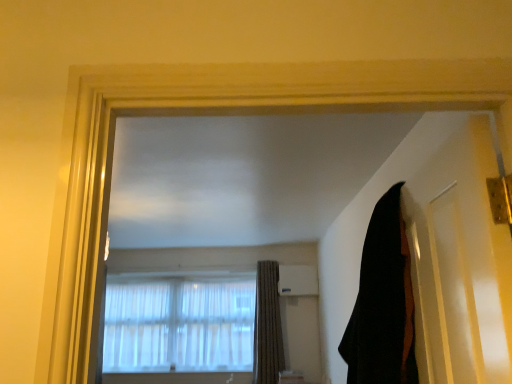
Question: Does black matte door at right have a larger size compared to translucent fabric at center?

Choices:
 (A) no
 (B) yes

Answer: (A)

Question: Is black matte door at right aimed at translucent fabric at center?

Choices:
 (A) yes
 (B) no

Answer: (B)

Question: Is black matte door at right behind translucent fabric at center?

Choices:
 (A) no
 (B) yes

Answer: (A)

Question: From a real-world perspective, is black matte door at right beneath translucent fabric at center?

Choices:
 (A) no
 (B) yes

Answer: (A)

Question: From a real-world perspective, is black matte door at right on top of translucent fabric at center?

Choices:
 (A) no
 (B) yes

Answer: (B)

Question: Does point (395, 372) appear closer or farther from the camera than point (147, 274)?

Choices:
 (A) closer
 (B) farther

Answer: (A)

Question: Based on their positions, is black fabric curtain at right, the first curtain viewed from the right, located to the left or right of translucent fabric at center?

Choices:
 (A) left
 (B) right

Answer: (B)

Question: Relative to translucent fabric at center, is black fabric curtain at right, arranged as the first curtain when viewed from the top, in front or behind?

Choices:
 (A) front
 (B) behind

Answer: (A)

Question: Is black fabric curtain at right, arranged as the first curtain when viewed from the top, wider or thinner than translucent fabric at center?

Choices:
 (A) thin
 (B) wide

Answer: (B)

Question: Relative to black fabric curtain at right, marked as the second curtain in a back-to-front arrangement, is black matte door at right in front or behind?

Choices:
 (A) behind
 (B) front

Answer: (B)

Question: Is black matte door at right bigger or smaller than black fabric curtain at right, which ranks as the 2th curtain in bottom-to-top order?

Choices:
 (A) small
 (B) big

Answer: (A)

Question: From a real-world perspective, is black matte door at right physically located above or below black fabric curtain at right, the first curtain viewed from the right?

Choices:
 (A) above
 (B) below

Answer: (A)

Question: Is point (404, 190) positioned closer to the camera than point (410, 362)?

Choices:
 (A) farther
 (B) closer

Answer: (A)

Question: Is point (408, 359) closer or farther from the camera than point (435, 200)?

Choices:
 (A) closer
 (B) farther

Answer: (B)

Question: In terms of height, does black fabric curtain at right, the first curtain viewed from the right, look taller or shorter compared to black matte door at right?

Choices:
 (A) tall
 (B) short

Answer: (A)